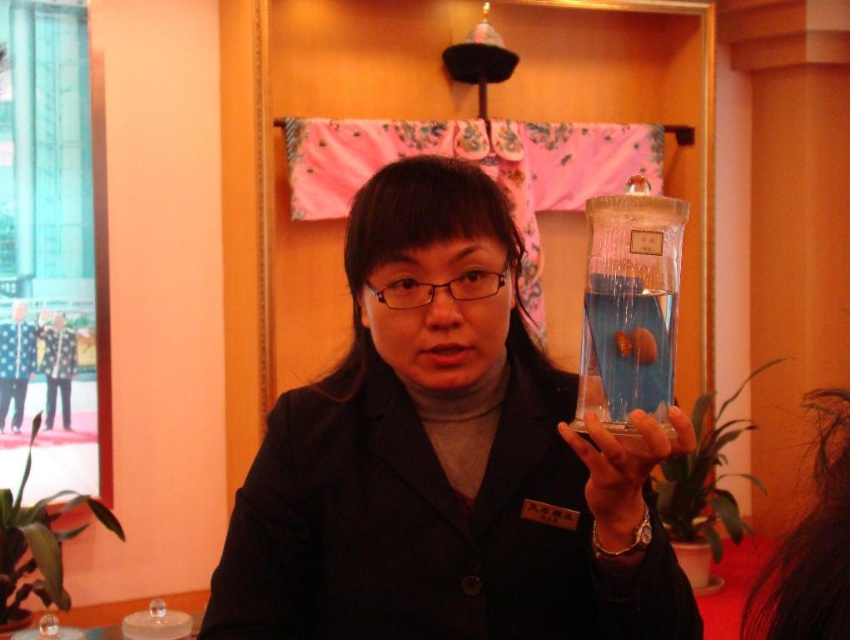
Question: Can you confirm if matte black jacket at center is positioned to the left of transparent glass bottle at center?

Choices:
 (A) yes
 (B) no

Answer: (A)

Question: In this image, where is matte black jacket at center located relative to transparent glass bottle at center?

Choices:
 (A) left
 (B) right

Answer: (A)

Question: Is matte black jacket at center thinner than transparent glass bottle at center?

Choices:
 (A) no
 (B) yes

Answer: (A)

Question: Which point appears closest to the camera in this image?

Choices:
 (A) (463, 547)
 (B) (633, 198)

Answer: (B)

Question: Which point is closer to the camera?

Choices:
 (A) matte black jacket at center
 (B) transparent glass bottle at center

Answer: (A)